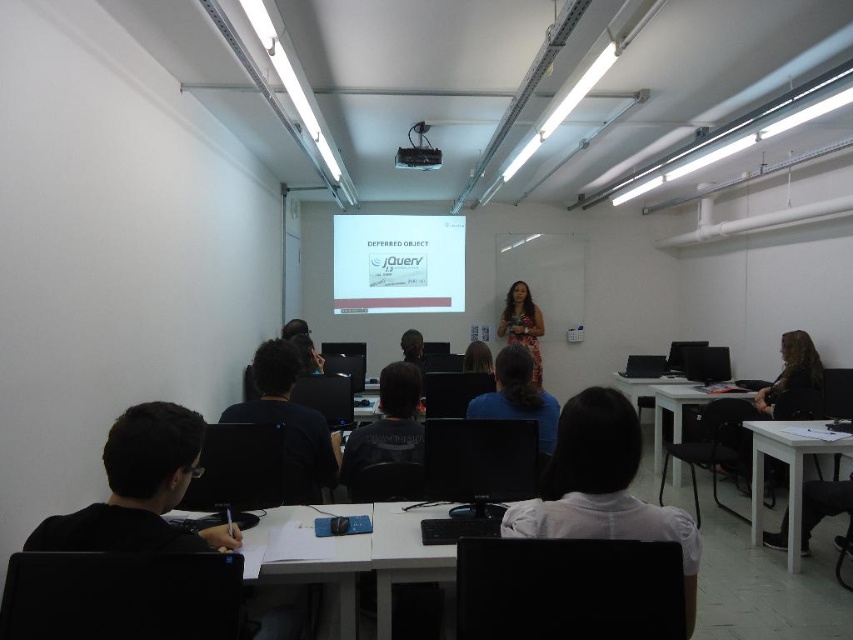
Question: Which object is positioned closest to the matte brown dress at center?

Choices:
 (A) blue fabric shirt at center
 (B) white plastic table at lower center
 (C) black matte monitor at center
 (D) white matte shirt at center

Answer: (A)

Question: Does black matte shirt at lower left appear on the left side of black glossy laptop at center?

Choices:
 (A) yes
 (B) no

Answer: (A)

Question: Based on their relative distances, which object is farther from the dark brown hair at center?

Choices:
 (A) blue fabric shirt at center
 (B) white matte shirt at center
 (C) white plastic table at lower right
 (D) black glossy laptop at center

Answer: (D)

Question: Can you confirm if blue fabric shirt at center is thinner than white plastic table at lower right?

Choices:
 (A) yes
 (B) no

Answer: (A)

Question: Does black matte monitor at center have a lesser width compared to dark brown hair at center?

Choices:
 (A) yes
 (B) no

Answer: (B)

Question: Which is nearer to the black plastic projector at upper center?

Choices:
 (A) white plastic table at lower right
 (B) dark gray shirt at center
 (C) black matte monitor at center

Answer: (B)